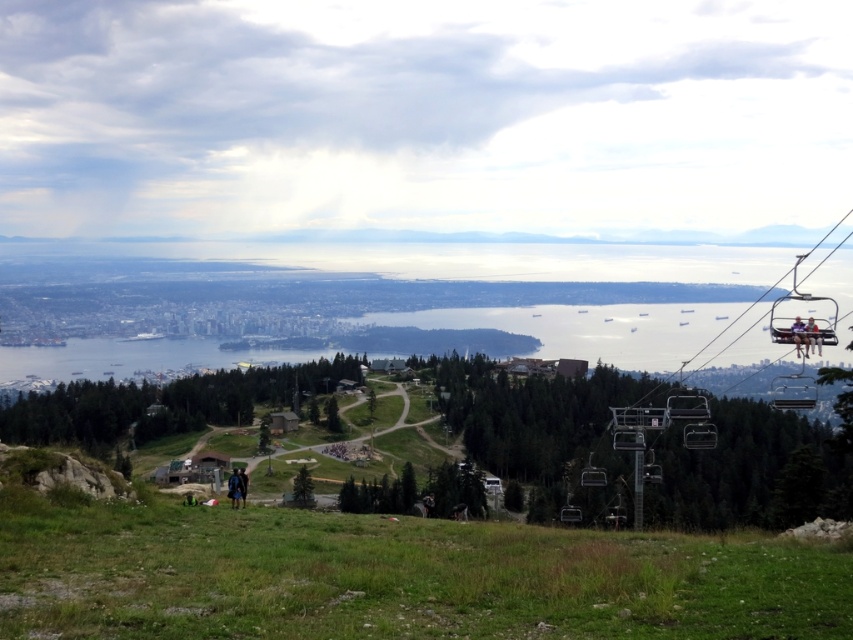
Question: Can you confirm if metallic silver ski lift at right is positioned to the right of matte black chairlift at lower center?

Choices:
 (A) yes
 (B) no

Answer: (A)

Question: Does light brown wooden chair at right have a smaller size compared to blue denim jacket at upper right?

Choices:
 (A) yes
 (B) no

Answer: (B)

Question: Which is nearer to the dark blue jacket at lower center?

Choices:
 (A) light brown wooden chair at right
 (B) matte black chairlift at lower center
 (C) blue denim jacket at upper right
 (D) metallic silver ski lift at right

Answer: (C)

Question: Which of the following is the farthest from the observer?

Choices:
 (A) matte black chairlift at lower center
 (B) dark blue jacket at lower center

Answer: (A)

Question: Observing the image, what is the correct spatial positioning of metallic silver ski lift at right in reference to light brown wooden chair at right?

Choices:
 (A) right
 (B) left

Answer: (A)

Question: Which of these objects is positioned closest to the matte black chairlift at lower center?

Choices:
 (A) dark blue jacket at lower center
 (B) blue denim jacket at upper right
 (C) light brown wooden chair at right

Answer: (C)